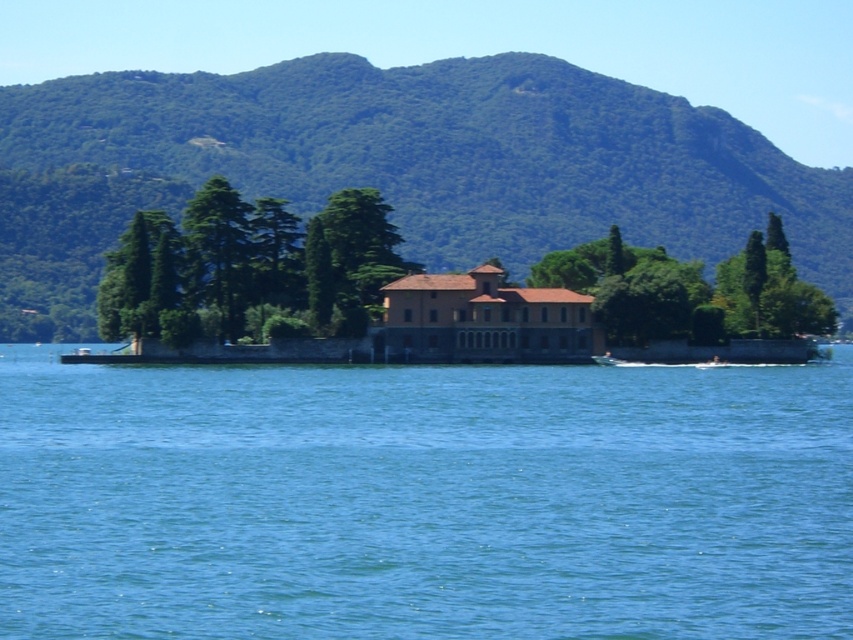
Question: Which object is closer to the camera taking this photo?

Choices:
 (A) blue water at center
 (B) green textured tree at center
 (C) green leafy mountain at center

Answer: (A)

Question: Which is farther from the green textured trees at center?

Choices:
 (A) green leafy tree at center
 (B) green textured tree at center
 (C) blue water at center
 (D) green leafy mountain at center

Answer: (D)

Question: Does blue water at center have a larger size compared to green leafy mountain at center?

Choices:
 (A) yes
 (B) no

Answer: (B)

Question: Which point is closer to the camera taking this photo?

Choices:
 (A) (103, 628)
 (B) (506, 204)
 (C) (683, 278)

Answer: (A)

Question: Is green leafy mountain at center positioned at the back of green leafy tree at center?

Choices:
 (A) no
 (B) yes

Answer: (B)

Question: Can you confirm if green leafy mountain at center is positioned above green textured tree at center?

Choices:
 (A) no
 (B) yes

Answer: (B)